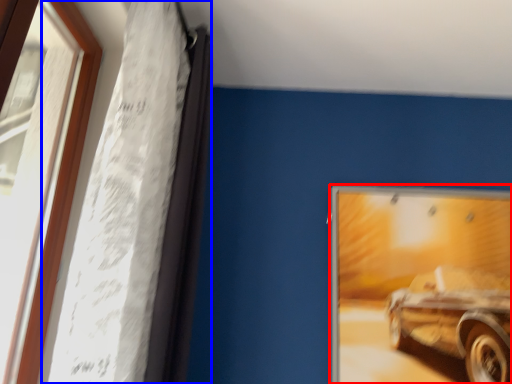
Question: Which point is further to the camera, picture frame (highlighted by a red box) or curtain (highlighted by a blue box)?

Choices:
 (A) picture frame
 (B) curtain

Answer: (A)